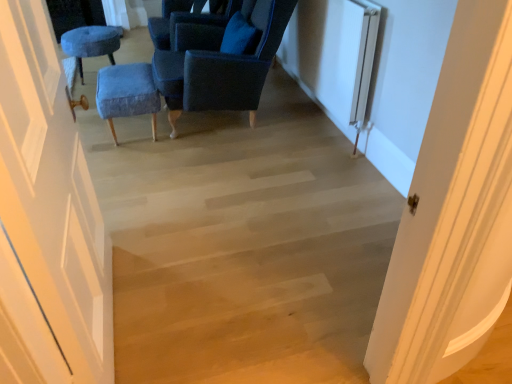
Identify the location of free space below velvet blue ottoman at center, positioned as the first furniture in front-to-back order (from a real-world perspective). The width and height of the screenshot is (512, 384). point(133,135).